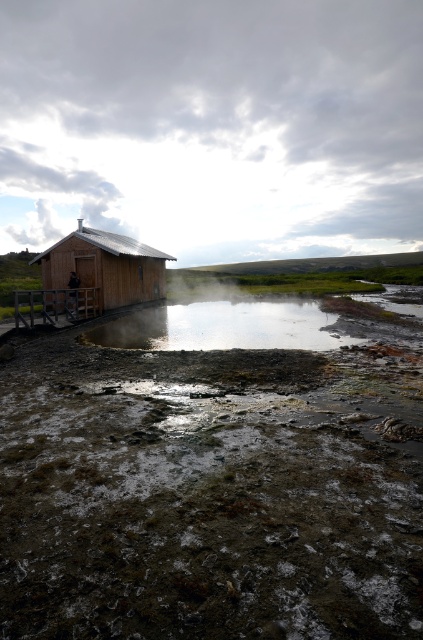
Does clear water at center appear under wooden hut at left?

Yes, clear water at center is below wooden hut at left.

Does clear water at center have a greater height compared to wooden hut at left?

In fact, clear water at center may be shorter than wooden hut at left.

This screenshot has width=423, height=640. What are the coordinates of `clear water at center` in the screenshot? It's located at (230, 326).

Is muddy wet ground at lower left below wooden hut at left?

Yes.

Is point (169, 419) farther from camera compared to point (156, 250)?

No, it is not.

Image resolution: width=423 pixels, height=640 pixels. Find the location of `muddy wet ground at lower left`. muddy wet ground at lower left is located at coordinates (214, 484).

The image size is (423, 640). I want to click on muddy wet ground at lower left, so click(x=214, y=484).

Is muddy wet ground at lower left positioned before clear water at center?

Yes, muddy wet ground at lower left is closer to the viewer.

Where is `muddy wet ground at lower left`? This screenshot has height=640, width=423. muddy wet ground at lower left is located at coordinates (214, 484).